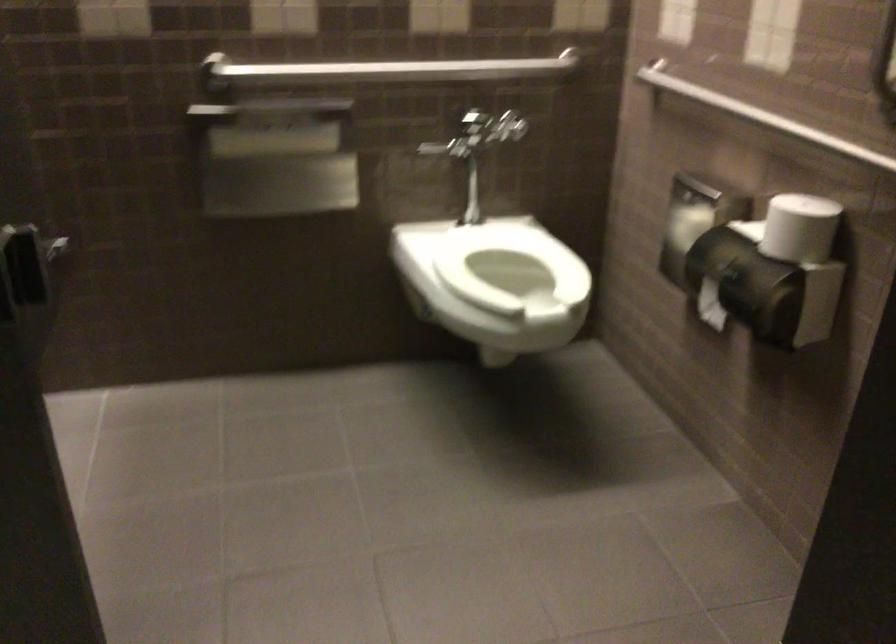
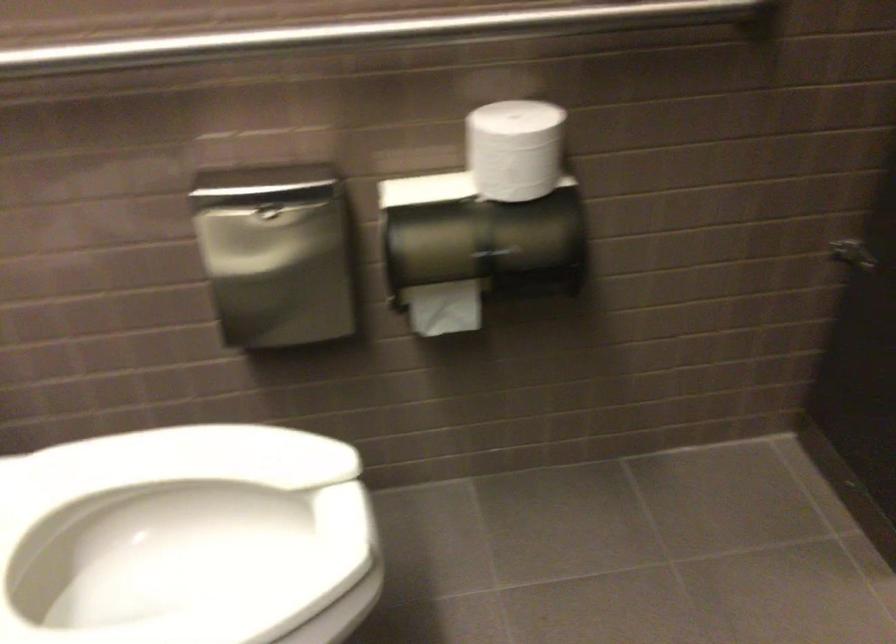
Locate, in the second image, the point that corresponds to pixel 719 259 in the first image.

(474, 247)